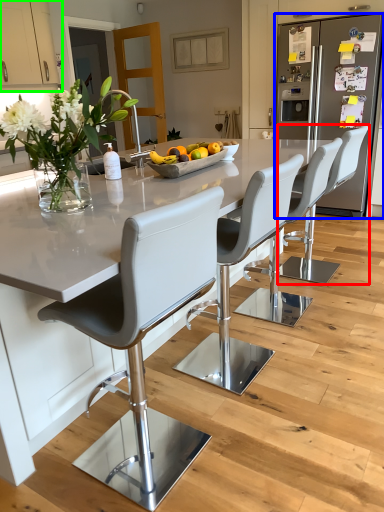
Question: Based on their relative distances, which object is farther from chair (highlighted by a red box)? Choose from fridge (highlighted by a blue box) and cabinetry (highlighted by a green box).

Choices:
 (A) fridge
 (B) cabinetry

Answer: (B)